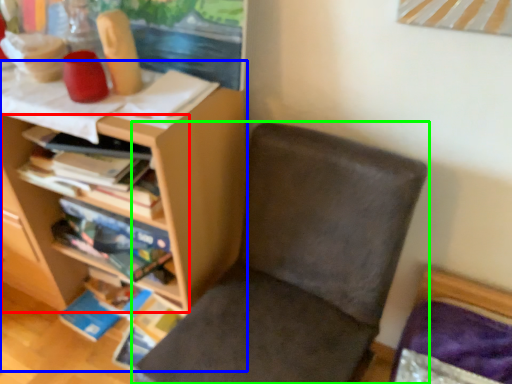
Question: Estimate the real-world distances between objects in this image. Which object is closer to shelf (highlighted by a red box), shelf (highlighted by a blue box) or chair (highlighted by a green box)?

Choices:
 (A) shelf
 (B) chair

Answer: (A)